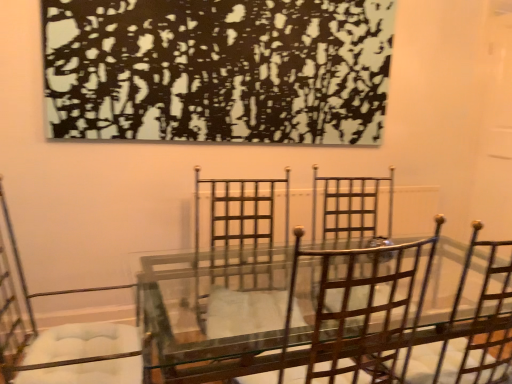
Question: Can you confirm if metallic brown chair at center, the 2th chair positioned from the left, is thinner than black textured painting at upper center?

Choices:
 (A) no
 (B) yes

Answer: (A)

Question: Is black textured painting at upper center at the back of metallic brown chair at center, which is the first chair in right-to-left order?

Choices:
 (A) yes
 (B) no

Answer: (B)

Question: Is metallic brown chair at center, the 2th chair positioned from the left, smaller than black textured painting at upper center?

Choices:
 (A) no
 (B) yes

Answer: (B)

Question: Would you consider metallic brown chair at center, the 2th chair positioned from the left, to be distant from black textured painting at upper center?

Choices:
 (A) no
 (B) yes

Answer: (B)

Question: Is metallic brown chair at center, which is the first chair in right-to-left order, oriented towards black textured painting at upper center?

Choices:
 (A) no
 (B) yes

Answer: (A)

Question: Considering the positions of point (347, 87) and point (332, 362), is point (347, 87) closer or farther from the camera than point (332, 362)?

Choices:
 (A) farther
 (B) closer

Answer: (A)

Question: Is black textured painting at upper center wider or thinner than metallic brown chair at center, which is the first chair in right-to-left order?

Choices:
 (A) thin
 (B) wide

Answer: (A)

Question: From a real-world perspective, is black textured painting at upper center physically located above or below metallic brown chair at center, the 2th chair positioned from the left?

Choices:
 (A) below
 (B) above

Answer: (B)

Question: Considering their positions, is black textured painting at upper center located in front of or behind metallic brown chair at center, which is the first chair in right-to-left order?

Choices:
 (A) behind
 (B) front

Answer: (A)

Question: From the image's perspective, is metallic silver chair at left, arranged as the first chair when viewed from the left, above or below metallic brown chair at center, which is the first chair in right-to-left order?

Choices:
 (A) above
 (B) below

Answer: (B)

Question: Is metallic silver chair at left, the 2th chair from the right, spatially inside metallic brown chair at center, the 2th chair positioned from the left, or outside of it?

Choices:
 (A) inside
 (B) outside

Answer: (B)

Question: From a real-world perspective, relative to metallic brown chair at center, which is the first chair in right-to-left order, is metallic silver chair at left, the 2th chair from the right, vertically above or below?

Choices:
 (A) below
 (B) above

Answer: (A)

Question: In the image, is metallic silver chair at left, arranged as the first chair when viewed from the left, positioned in front of or behind metallic brown chair at center, which is the first chair in right-to-left order?

Choices:
 (A) front
 (B) behind

Answer: (B)

Question: Is point (268, 137) positioned closer to the camera than point (23, 284)?

Choices:
 (A) farther
 (B) closer

Answer: (A)

Question: In terms of width, does black textured painting at upper center look wider or thinner when compared to metallic silver chair at left, the 2th chair from the right?

Choices:
 (A) thin
 (B) wide

Answer: (A)